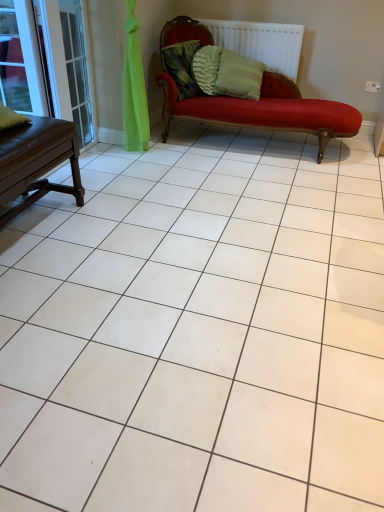
Identify the location of free point above white textured radiator at upper center (from a real-world perspective). (251, 17).